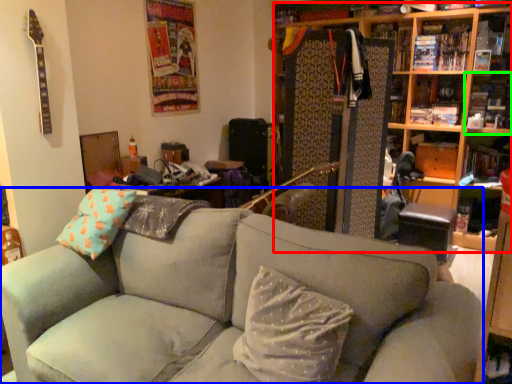
Question: Estimate the real-world distances between objects in this image. Which object is closer to bookcase (highlighted by a red box), studio couch (highlighted by a blue box) or shelf (highlighted by a green box)?

Choices:
 (A) studio couch
 (B) shelf

Answer: (B)